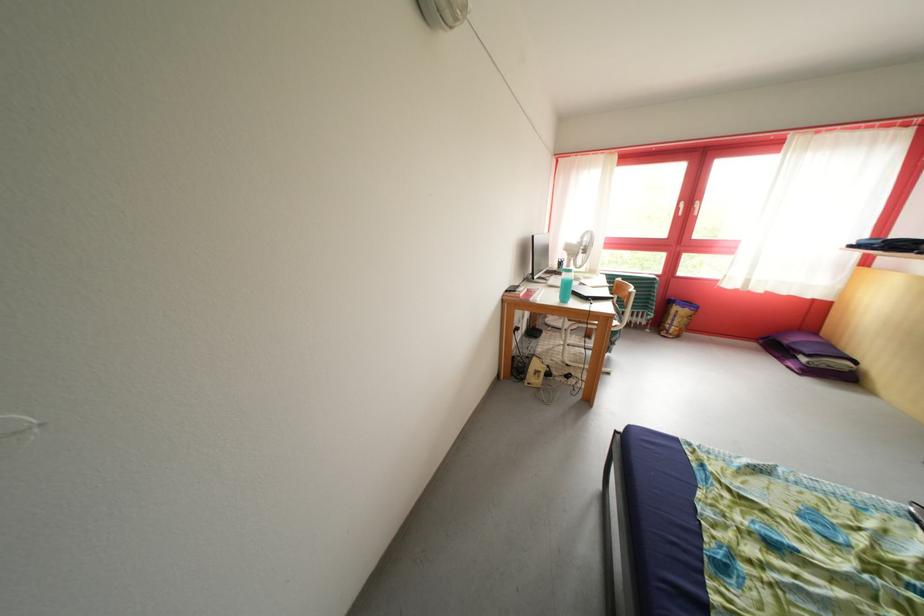
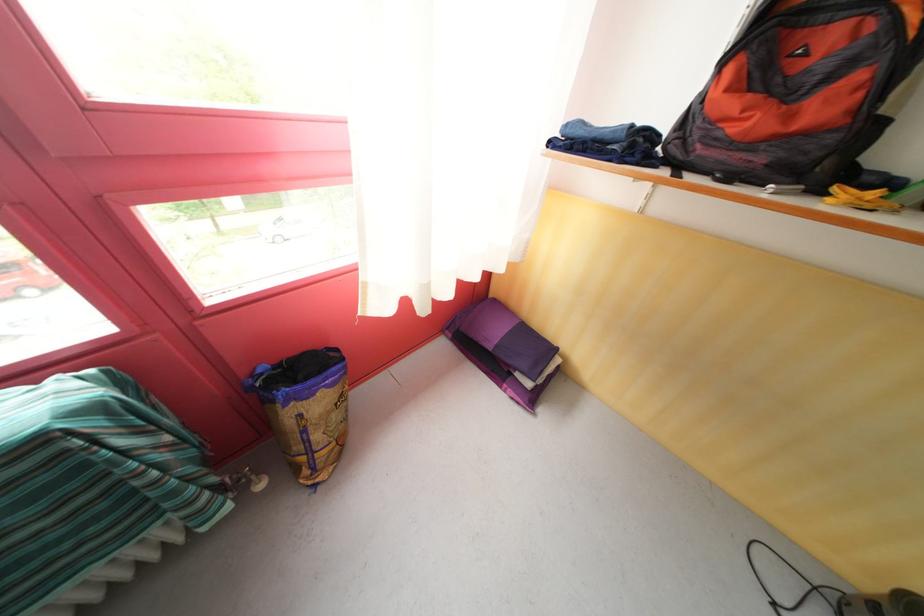
Locate, in the second image, the point that corresponds to the point at 675,328 in the first image.

(305, 454)